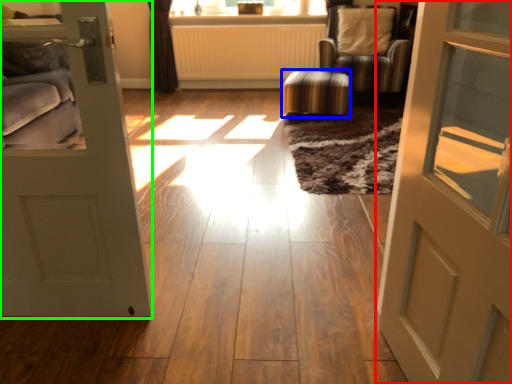
Question: Which object is positioned closest to door (highlighted by a red box)? Select from stool (highlighted by a blue box) and door (highlighted by a green box).

Choices:
 (A) stool
 (B) door

Answer: (B)